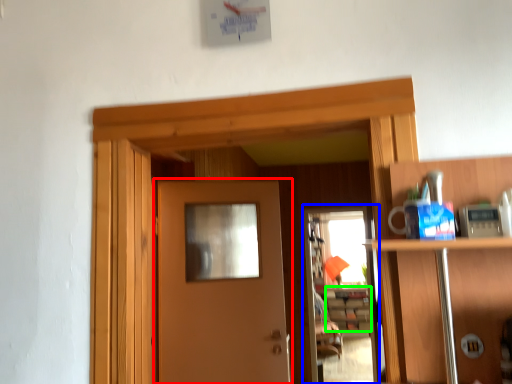
Question: Which is farther away from door (highlighted by a red box)? screen door (highlighted by a blue box) or cabinetry (highlighted by a green box)?

Choices:
 (A) screen door
 (B) cabinetry

Answer: (B)